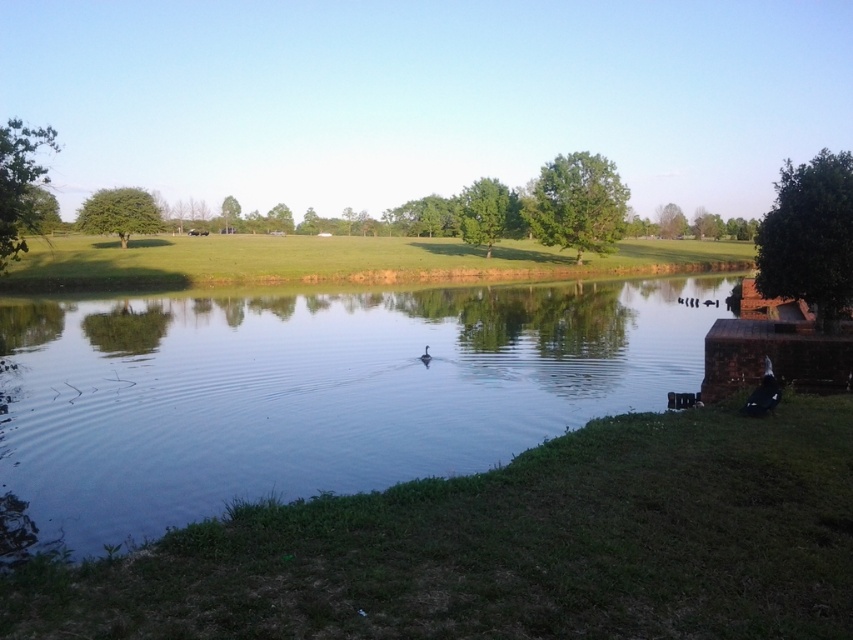
Looking at this image, is clear water at center thinner than black matte duck at center?

No, clear water at center is not thinner than black matte duck at center.

Looking at this image, is clear water at center shorter than black matte duck at center?

Incorrect, clear water at center's height does not fall short of black matte duck at center's.

Describe the element at coordinates (310, 394) in the screenshot. The image size is (853, 640). I see `clear water at center` at that location.

The width and height of the screenshot is (853, 640). In order to click on clear water at center in this screenshot , I will do `click(310, 394)`.

Is green grassy field at center to the left of black matte duck at center from the viewer's perspective?

In fact, green grassy field at center is to the right of black matte duck at center.

Can you confirm if green grassy field at center is shorter than black matte duck at center?

No.

Which is in front, point (273, 259) or point (428, 358)?

Positioned in front is point (428, 358).

The image size is (853, 640). What are the coordinates of `green grassy field at center` in the screenshot? It's located at (339, 260).

Between clear water at center and green grassy field at center, which one appears on the left side from the viewer's perspective?

From the viewer's perspective, clear water at center appears more on the left side.

Which is in front, point (506, 342) or point (421, 262)?

Point (506, 342) is more forward.

What do you see at coordinates (310, 394) in the screenshot? This screenshot has width=853, height=640. I see `clear water at center` at bounding box center [310, 394].

Find the location of `clear water at center`. clear water at center is located at coordinates (310, 394).